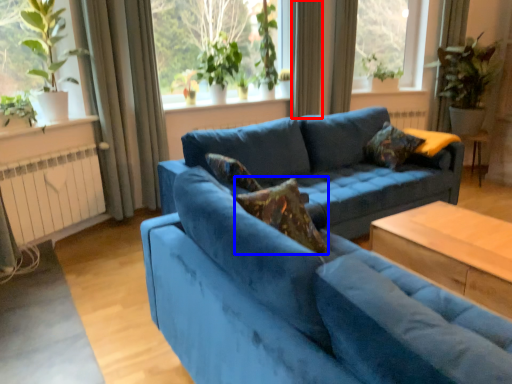
Question: Which point is closer to the camera, curtain (highlighted by a red box) or pillow (highlighted by a blue box)?

Choices:
 (A) curtain
 (B) pillow

Answer: (B)